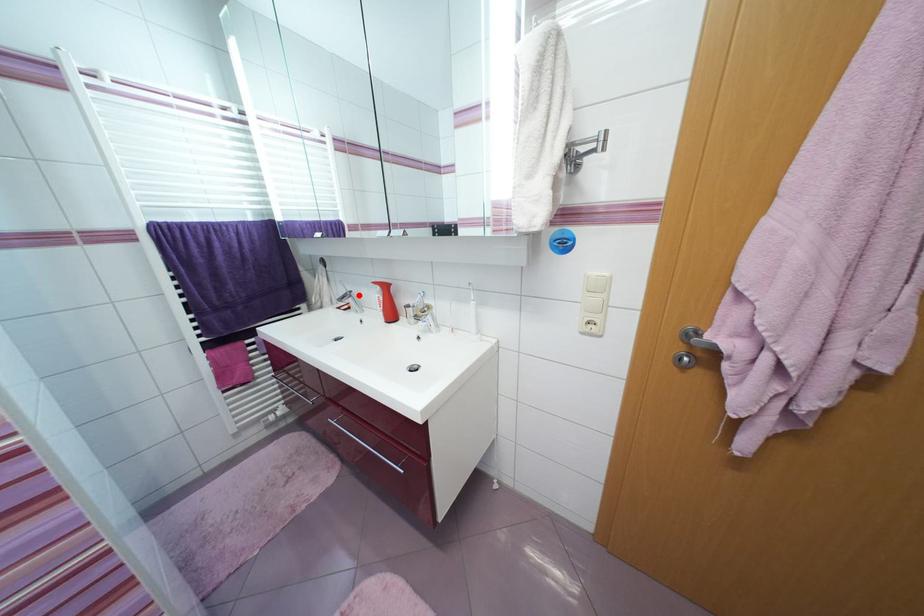
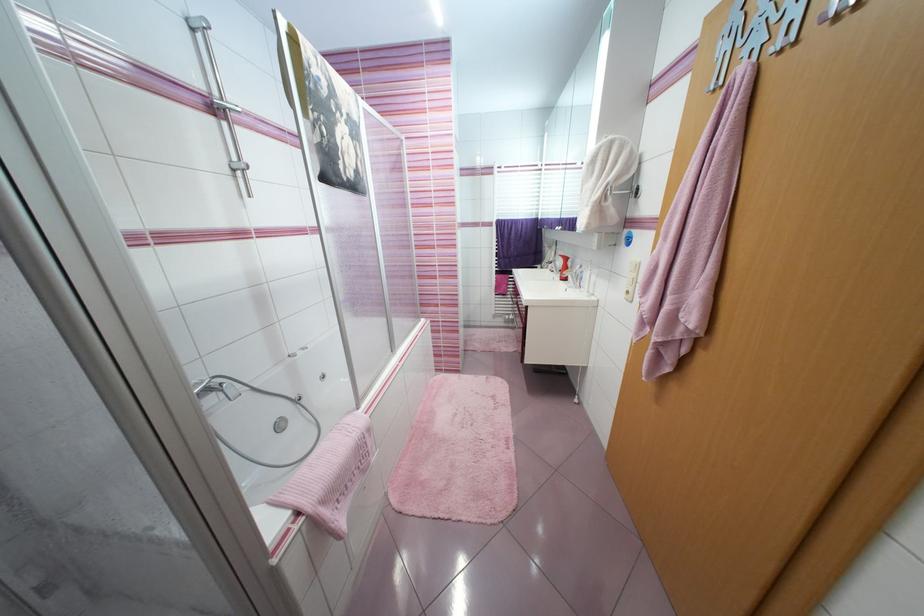
Where in the second image is the point corresponding to the highlighted location from the first image?

(563, 264)